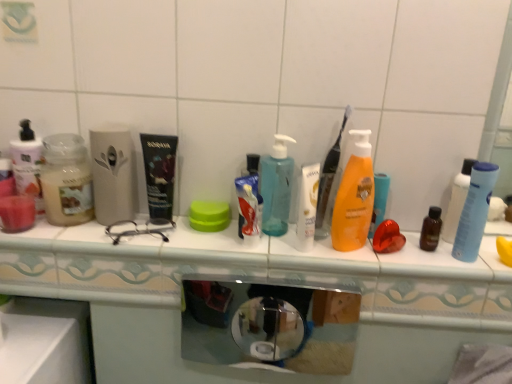
At what (x,y) coordinates should I click in order to perform the action: click on vacant area located to the right-hand side of white glossy toothpaste at center. Please return your answer as a coordinate pair (x, y). The image size is (512, 384). Looking at the image, I should click on (314, 251).